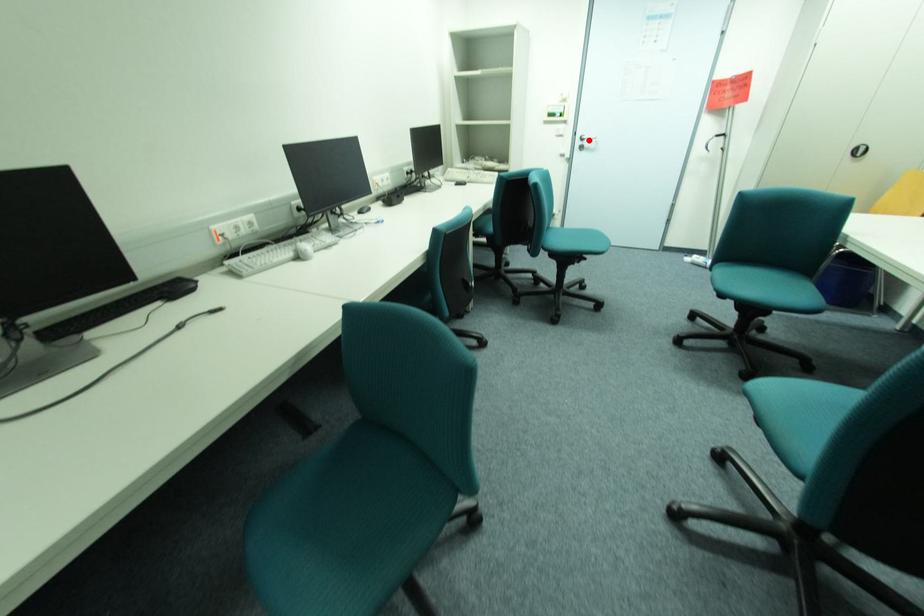
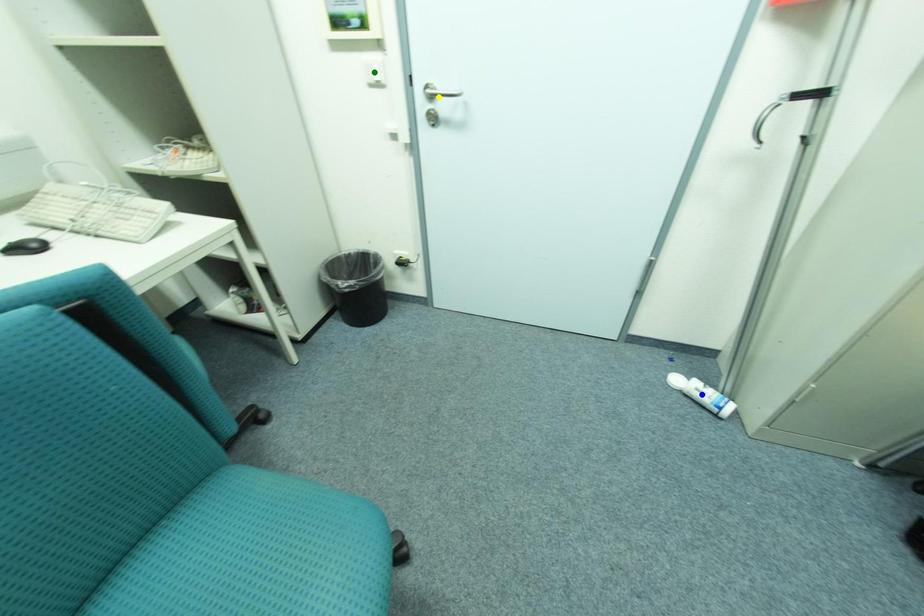
Question: I am providing you with two images of the same scene from different viewpoints. A red point is marked on the first image. You are given multiple points on the second image. Which mark in image 2 goes with the point in image 1?

Choices:
 (A) yellow point
 (B) blue point
 (C) green point

Answer: (A)